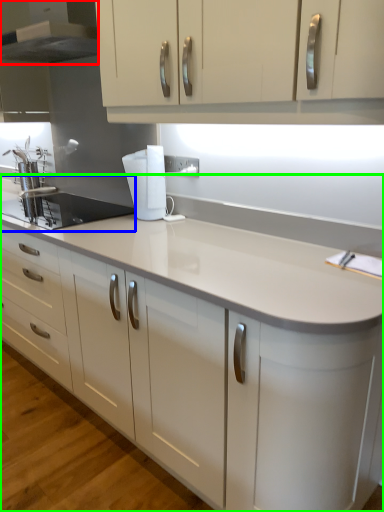
Question: Considering the real-world distances, which object is farthest from home appliance (highlighted by a red box)? sink (highlighted by a blue box) or countertop (highlighted by a green box)?

Choices:
 (A) sink
 (B) countertop

Answer: (B)